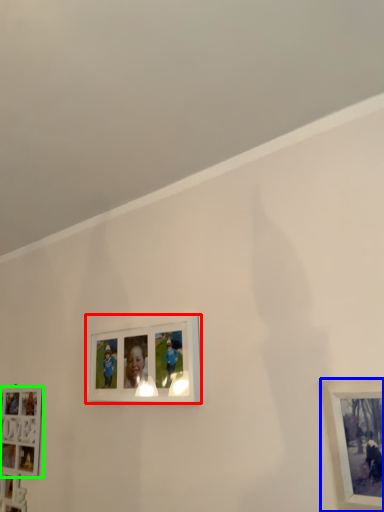
Question: Which is nearer to the picture frame (highlighted by a red box)? picture frame (highlighted by a blue box) or picture frame (highlighted by a green box).

Choices:
 (A) picture frame
 (B) picture frame

Answer: (B)